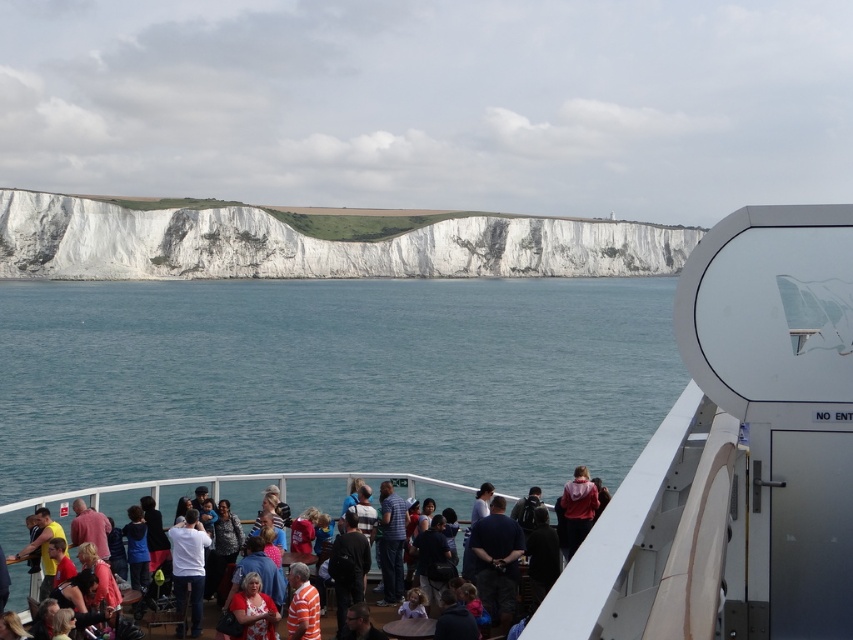
You are standing on the ship deck and want to take a photo of the White Cliffs of Dover. There is a person wearing multicolored casual clothing at center blocking your view. Where should you move to avoid them?

Move to the left or right of the person wearing multicolored casual clothing at center to avoid blocking the view of the White Cliffs of Dover.

You are a photographer on the ship deck. You want to capture a photo that includes both the white matte boat at center and the red hoodie at center. Since you want both subjects to be clearly visible, which object should you focus on to ensure proper framing?

The white matte boat at center is wider than the red hoodie at center, so focusing on the white matte boat at center ensures proper framing as it takes up more space in the frame.